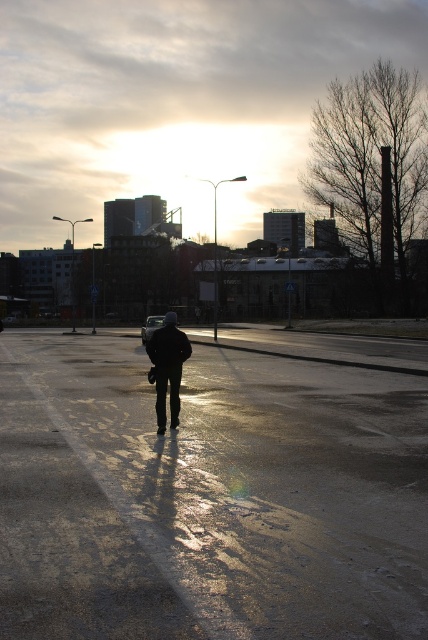
You are a delivery person who needs to cross the shiny asphalt parking lot at center to reach the dark matte jacket at center. The parking lot is wet and slippery. What is the shortest distance you need to walk?

The shortest distance you need to walk is 10.42 feet to reach the dark matte jacket at center from the shiny asphalt parking lot at center.

You are a photographer trying to capture the reflection of the shiny asphalt parking lot at center in your shot. Since the dark matte jacket at center is blocking the view, can you move the jacket to a position where it won not interfere with the reflection? Explain why or why not based on their positions.

The shiny asphalt parking lot at center is closer to the viewer than the dark matte jacket at center. Since the jacket is farther away, moving it closer to the parking lot would place it in front of the parking lot, potentially blocking the reflection. Alternatively, moving the jacket further away might allow the parking lot to remain visible, but the jacket might still cast a shadow depending on lighting. However, since the jacket is already at center and the parking lot is also at center, precise repositi

From the picture: You are a delivery person trying to decide whether to park your vehicle on the shiny asphalt parking lot at center or next to the dark matte jacket at center. Based on the height of the two, which location would allow your vehicle to park without hitting the other object?

The shiny asphalt parking lot at center is shorter than the dark matte jacket at center, so parking next to the shiny asphalt parking lot at center would be safer as it is lower and less likely to hit the vehicle.